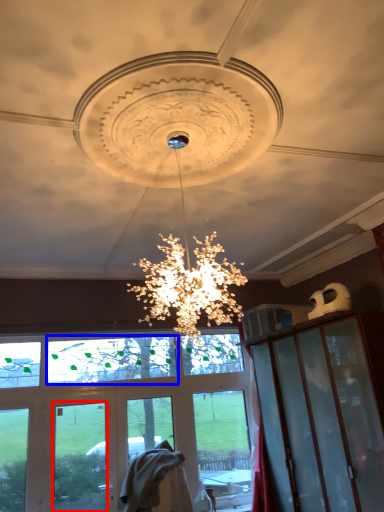
Question: Which of the following is the farthest to the observer, glass window (highlighted by a red box) or window screen (highlighted by a blue box)?

Choices:
 (A) glass window
 (B) window screen

Answer: (B)